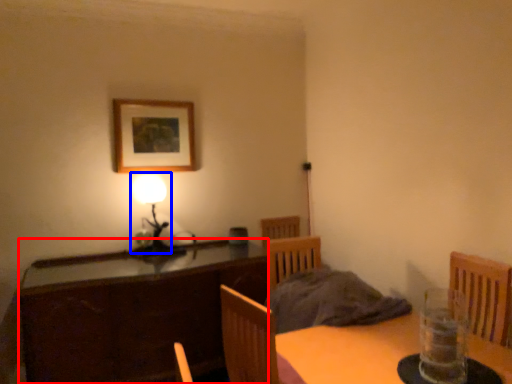
Question: Which point is closer to the camera, cabinetry (highlighted by a red box) or table lamp (highlighted by a blue box)?

Choices:
 (A) cabinetry
 (B) table lamp

Answer: (A)